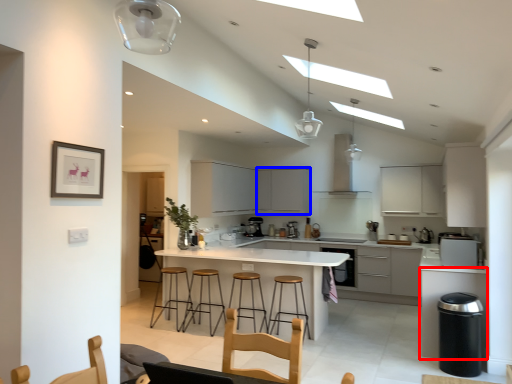
Question: Which of the following is the farthest to the observer, cabinetry (highlighted by a red box) or cabinetry (highlighted by a blue box)?

Choices:
 (A) cabinetry
 (B) cabinetry

Answer: (B)